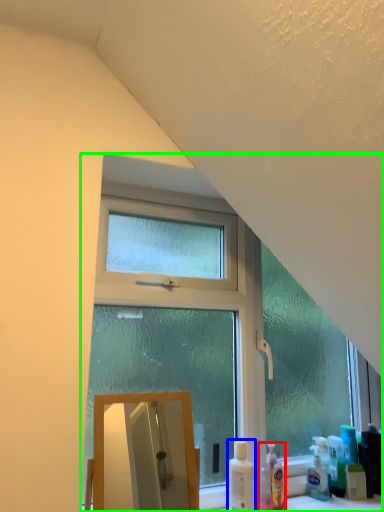
Question: Which is farther away from cleaning product (highlighted by a red box)? cleaning product (highlighted by a blue box) or window (highlighted by a green box)?

Choices:
 (A) cleaning product
 (B) window

Answer: (B)